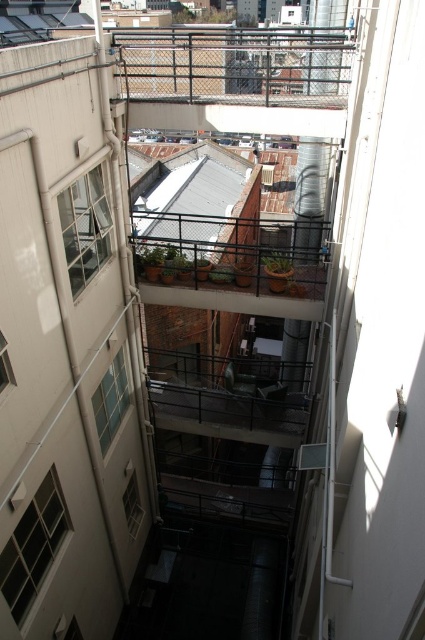
You are standing on an adjacent rooftop and want to assess the distance to the metal mesh balcony at center. Based on the scene, can you estimate how far it is?

The metal mesh balcony at center is 12.85 meters away from the viewer.